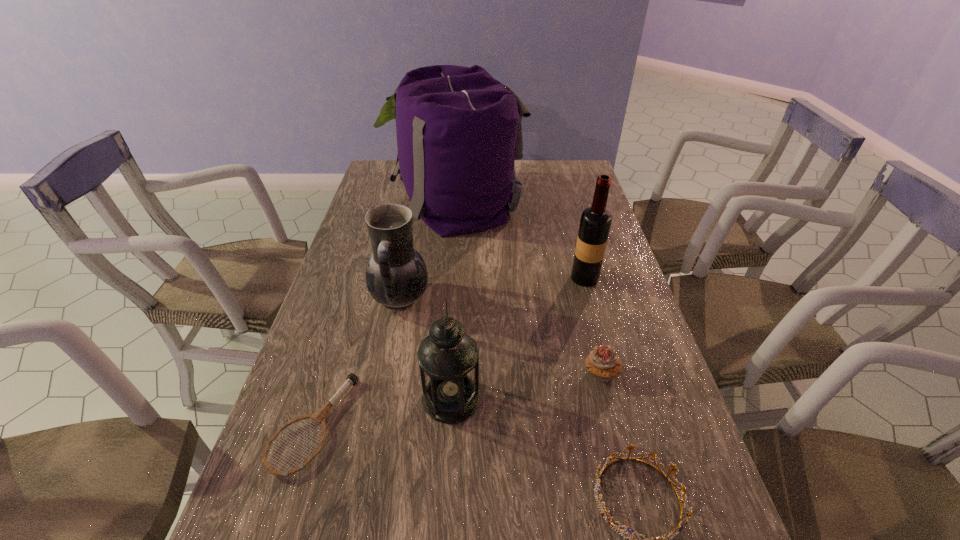
Where is `vacant space at the left edge`? vacant space at the left edge is located at coordinates (345, 443).

In the image, there is a desktop. In order to click on free space at the right edge in this screenshot , I will do `click(623, 372)`.

The width and height of the screenshot is (960, 540). Find the location of `vacant space at the far right corner of the desktop`. vacant space at the far right corner of the desktop is located at coordinates (552, 186).

I want to click on free point between the shortest object and the oil lamp, so click(382, 412).

At what (x,y) coordinates should I click in order to perform the action: click on vacant point located between the fifth tallest object and the tallest object. Please return your answer as a coordinate pair (x, y). Image resolution: width=960 pixels, height=540 pixels. Looking at the image, I should click on (529, 287).

Where is `vacant region between the wine bottle and the pitcher`? The height and width of the screenshot is (540, 960). vacant region between the wine bottle and the pitcher is located at coordinates (492, 288).

The width and height of the screenshot is (960, 540). Find the location of `vacant space that is in between the cupcake and the oil lamp`. vacant space that is in between the cupcake and the oil lamp is located at coordinates (526, 386).

Locate an element on the screen. The width and height of the screenshot is (960, 540). free space between the oil lamp and the wine bottle is located at coordinates (518, 338).

The width and height of the screenshot is (960, 540). I want to click on free space between the wine bottle and the cupcake, so pyautogui.click(x=593, y=326).

The width and height of the screenshot is (960, 540). I want to click on empty space that is in between the cupcake and the wine bottle, so click(x=593, y=326).